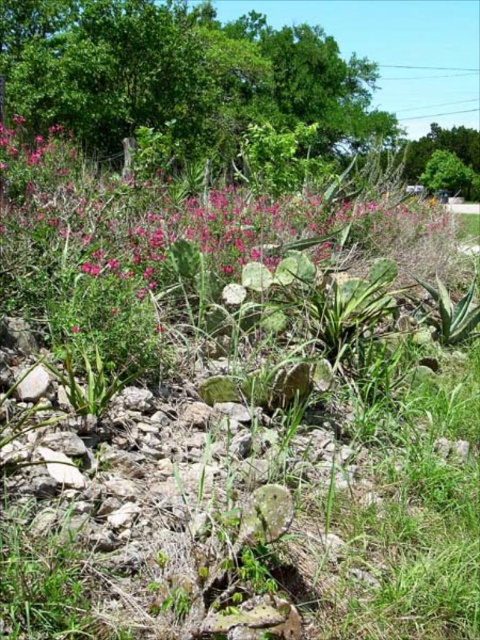
You are standing in the landscape and want to pick the pink matte flowers at center. Which direction should you move relative to the green leafy tree at upper right to reach them?

The pink matte flowers at center are to the left of the green leafy tree at upper right, so you should move to the left of the green leafy tree at upper right to reach them.

You are standing in a natural landscape with green grass, scattered rocks, cacti, and succulents. You notice a point marked at coordinates (181, 76). What object is located at this point?

The point at coordinates (181, 76) marks the location of the green leafy tree at upper center.